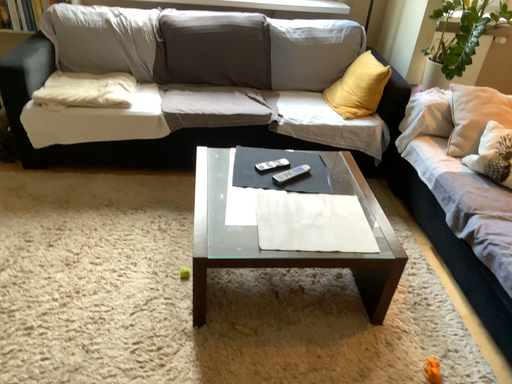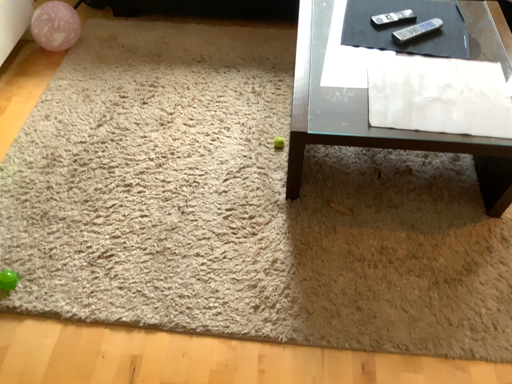
Question: Which way did the camera rotate in the video?

Choices:
 (A) rotated downward
 (B) rotated upward

Answer: (A)